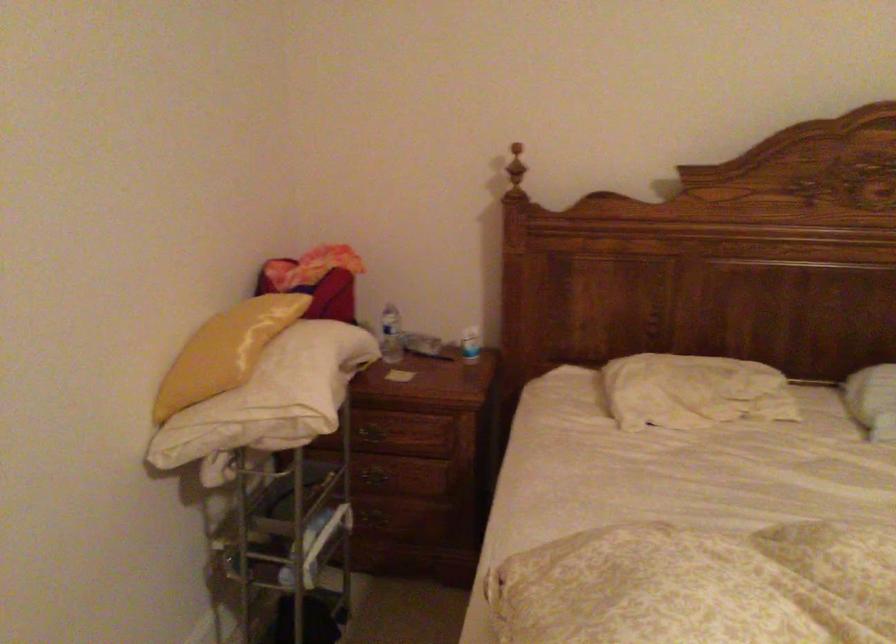
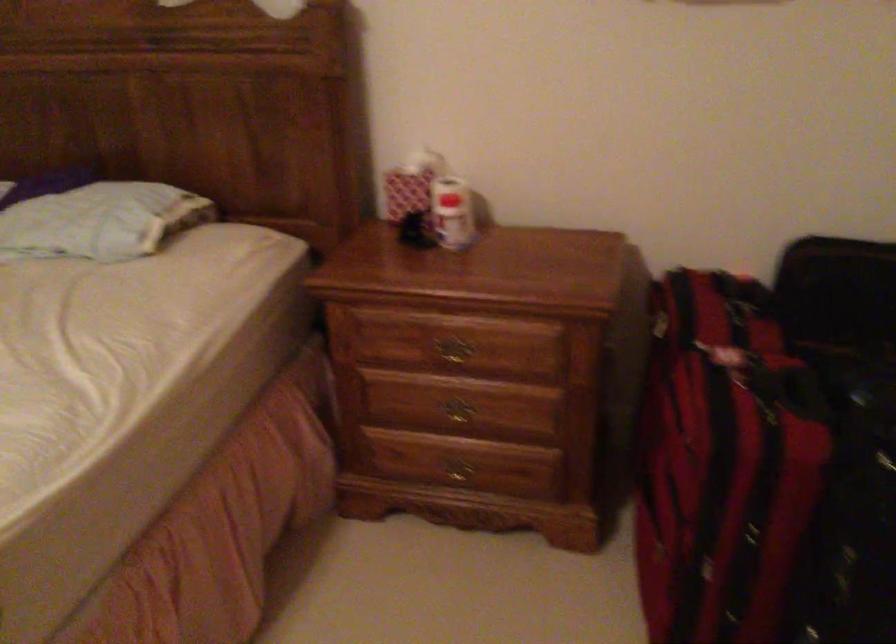
Question: Which direction would the cameraman need to move to produce the second image? Reply with the corresponding letter.

Choices:
 (A) Left
 (B) Right
 (C) Forward
 (D) Backward

Answer: (B)